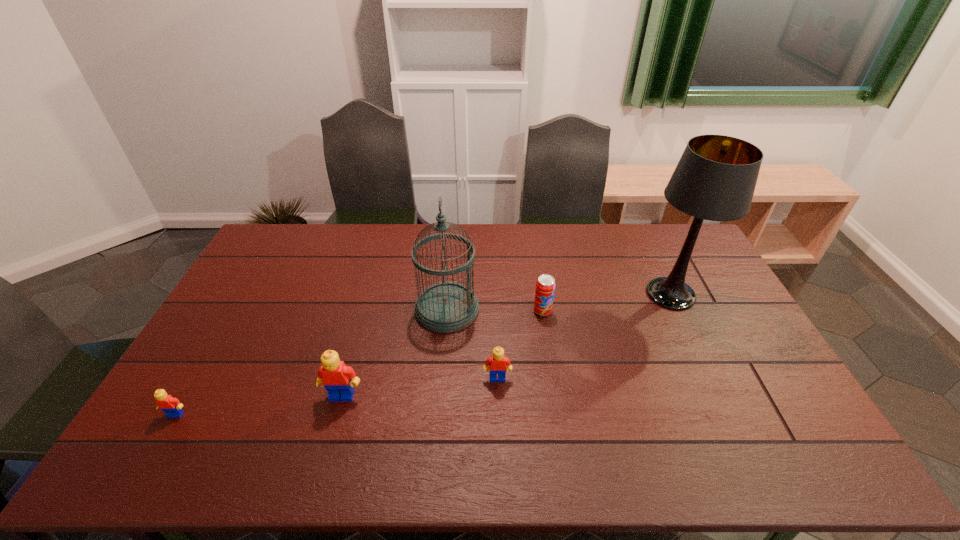
Locate an element on the screen. This screenshot has width=960, height=540. blank space at the near edge is located at coordinates (342, 424).

Image resolution: width=960 pixels, height=540 pixels. In the image, there is a desktop. In order to click on vacant space at the left edge in this screenshot , I will do `click(259, 286)`.

Image resolution: width=960 pixels, height=540 pixels. In order to click on blank area at the right edge in this screenshot , I will do `click(753, 338)`.

The height and width of the screenshot is (540, 960). Identify the location of free point at the near left corner. (159, 424).

Where is `vacant space at the far right corner of the desktop`? vacant space at the far right corner of the desktop is located at coordinates (685, 235).

Image resolution: width=960 pixels, height=540 pixels. I want to click on free spot between the third object from left to right and the second farthest Lego, so click(395, 352).

Locate an element on the screen. This screenshot has height=540, width=960. free space between the fourth object from left to right and the third object from left to right is located at coordinates (472, 343).

Where is `free spot between the second nearest object and the nearest Lego`? free spot between the second nearest object and the nearest Lego is located at coordinates (259, 404).

This screenshot has height=540, width=960. I want to click on vacant region between the second object from right to left and the rightmost object, so click(607, 302).

In order to click on empty space that is in between the fifth object from left to right and the leftmost Lego in this screenshot , I will do `click(359, 362)`.